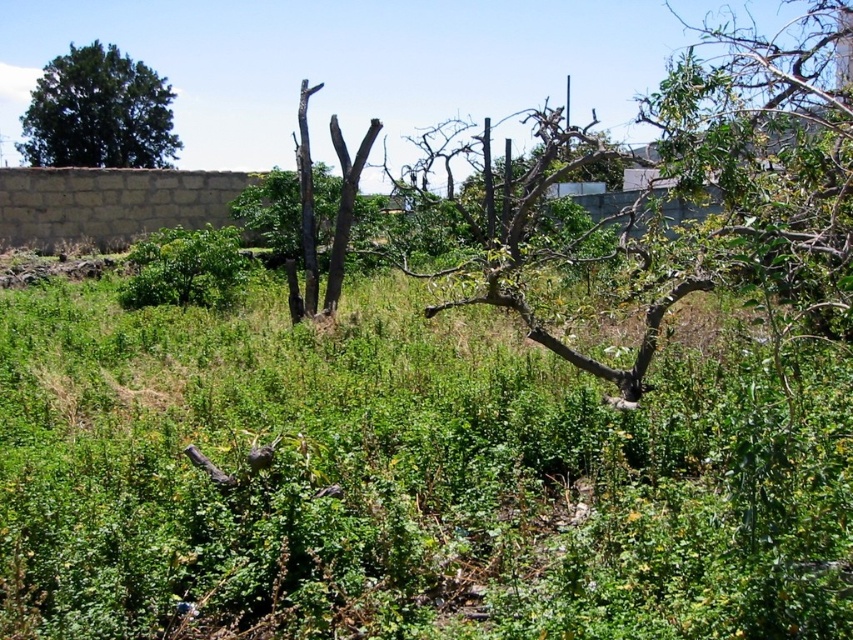
Question: Which point is farther to the camera?

Choices:
 (A) (125, 120)
 (B) (178, 273)

Answer: (A)

Question: Does dark green leafy tree at upper left have a greater width compared to green leafy bush at center?

Choices:
 (A) yes
 (B) no

Answer: (A)

Question: Is dark green leafy tree at upper left thinner than green leafy bush at center?

Choices:
 (A) yes
 (B) no

Answer: (B)

Question: Is dark green leafy tree at upper left in front of green leafy bush at center?

Choices:
 (A) yes
 (B) no

Answer: (B)